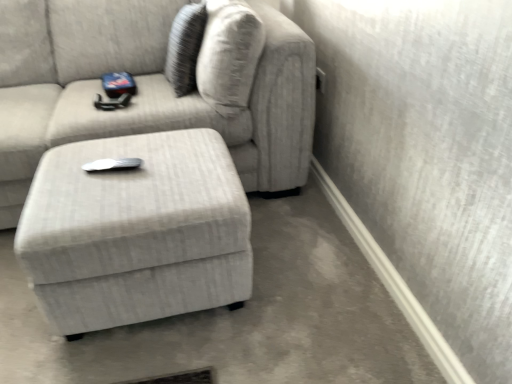
This screenshot has height=384, width=512. Identify the location of light gray fabric ottoman at center. (136, 231).

This screenshot has width=512, height=384. Describe the element at coordinates (136, 231) in the screenshot. I see `light gray fabric ottoman at center` at that location.

In the scene shown: Measure the distance between point (152, 244) and camera.

They are 1.13 meters apart.

Consider the image. What is the approximate width of textured fabric couch at center?

3.52 feet.

This screenshot has width=512, height=384. Describe the element at coordinates (156, 97) in the screenshot. I see `textured fabric couch at center` at that location.

The image size is (512, 384). I want to click on textured fabric couch at center, so click(x=156, y=97).

Locate an element on the screen. The image size is (512, 384). light gray fabric ottoman at center is located at coordinates (136, 231).

Consider the image. In the image, is textured fabric couch at center on the left side or the right side of light gray fabric ottoman at center?

textured fabric couch at center is positioned on light gray fabric ottoman at center's left side.

Between textured fabric couch at center and light gray fabric ottoman at center, which one is positioned in front?

light gray fabric ottoman at center is closer to the camera.

Is point (310, 121) more distant than point (207, 162)?

That is True.

From the image's perspective, which one is positioned higher, textured fabric couch at center or light gray fabric ottoman at center?

textured fabric couch at center, from the image's perspective.

Consider the image. From a real-world perspective, is textured fabric couch at center above or below light gray fabric ottoman at center?

In terms of real-world spatial position, textured fabric couch at center is above light gray fabric ottoman at center.

Is textured fabric couch at center wider or thinner than light gray fabric ottoman at center?

Considering their sizes, textured fabric couch at center looks broader than light gray fabric ottoman at center.

Between textured fabric couch at center and light gray fabric ottoman at center, which one has less height?

Standing shorter between the two is light gray fabric ottoman at center.

Is textured fabric couch at center bigger than light gray fabric ottoman at center?

Yes, textured fabric couch at center is bigger than light gray fabric ottoman at center.

Is textured fabric couch at center inside the boundaries of light gray fabric ottoman at center, or outside?

The correct answer is: outside.

Is textured fabric couch at center in contact with light gray fabric ottoman at center?

textured fabric couch at center and light gray fabric ottoman at center are not in contact.

Could you tell me if textured fabric couch at center is facing light gray fabric ottoman at center?

Yes, textured fabric couch at center is facing light gray fabric ottoman at center.

Image resolution: width=512 pixels, height=384 pixels. Identify the location of studio couch above the light gray fabric ottoman at center (from a real-world perspective). (156, 97).

Is light gray fabric ottoman at center at the right side of textured fabric couch at center?

Indeed, light gray fabric ottoman at center is positioned on the right side of textured fabric couch at center.

Is the position of light gray fabric ottoman at center more distant than that of textured fabric couch at center?

No, the depth of light gray fabric ottoman at center is less than that of textured fabric couch at center.

Does point (102, 211) come behind point (34, 131)?

No, (102, 211) is in front of (34, 131).

From the image's perspective, is light gray fabric ottoman at center positioned above or below textured fabric couch at center?

From the image's perspective, light gray fabric ottoman at center appears below textured fabric couch at center.

From a real-world perspective, between light gray fabric ottoman at center and textured fabric couch at center, who is vertically higher?

textured fabric couch at center is physically above.

Can you confirm if light gray fabric ottoman at center is wider than textured fabric couch at center?

In fact, light gray fabric ottoman at center might be narrower than textured fabric couch at center.

Considering the sizes of objects light gray fabric ottoman at center and textured fabric couch at center in the image provided, who is shorter, light gray fabric ottoman at center or textured fabric couch at center?

light gray fabric ottoman at center is shorter.

Is light gray fabric ottoman at center smaller than textured fabric couch at center?

Yes, light gray fabric ottoman at center is smaller than textured fabric couch at center.

Can we say light gray fabric ottoman at center lies outside textured fabric couch at center?

That's correct, light gray fabric ottoman at center is outside of textured fabric couch at center.

Are light gray fabric ottoman at center and textured fabric couch at center beside each other?

light gray fabric ottoman at center and textured fabric couch at center are not in contact.

Based on the photo, is light gray fabric ottoman at center oriented towards textured fabric couch at center?

No, light gray fabric ottoman at center is not turned towards textured fabric couch at center.

Where is `table to the right of textured fabric couch at center`? table to the right of textured fabric couch at center is located at coordinates (136, 231).

The height and width of the screenshot is (384, 512). Find the location of `studio couch behind the light gray fabric ottoman at center`. studio couch behind the light gray fabric ottoman at center is located at coordinates (156, 97).

This screenshot has width=512, height=384. Find the location of `table that appears below the textured fabric couch at center (from a real-world perspective)`. table that appears below the textured fabric couch at center (from a real-world perspective) is located at coordinates (136, 231).